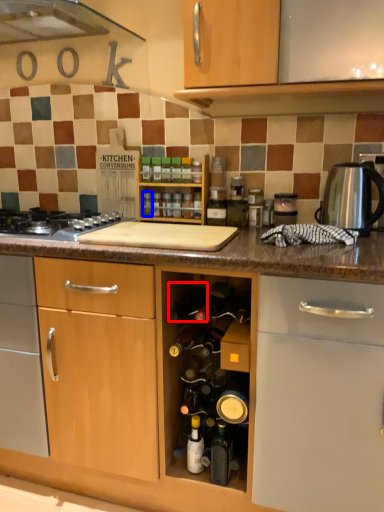
Question: Which of the following is the farthest to the observer, wine bottle (highlighted by a red box) or bottle (highlighted by a blue box)?

Choices:
 (A) wine bottle
 (B) bottle

Answer: (B)